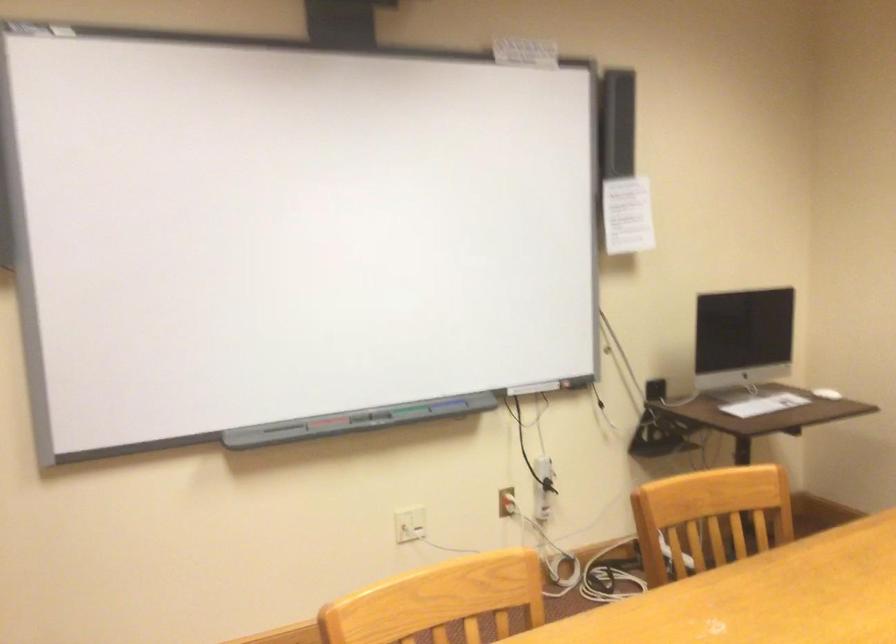
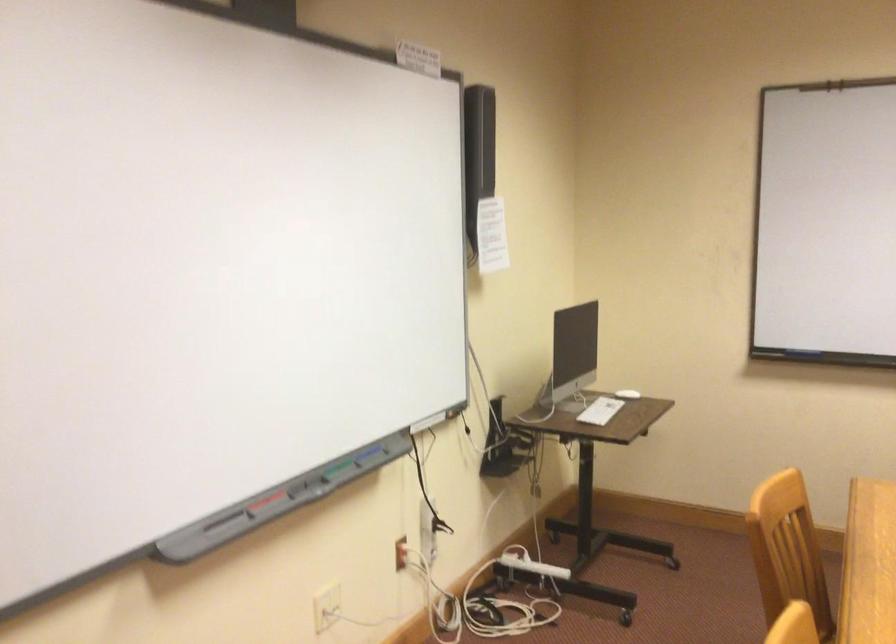
Where in the second image is the point corresponding to (373,415) from the first image?

(302, 484)